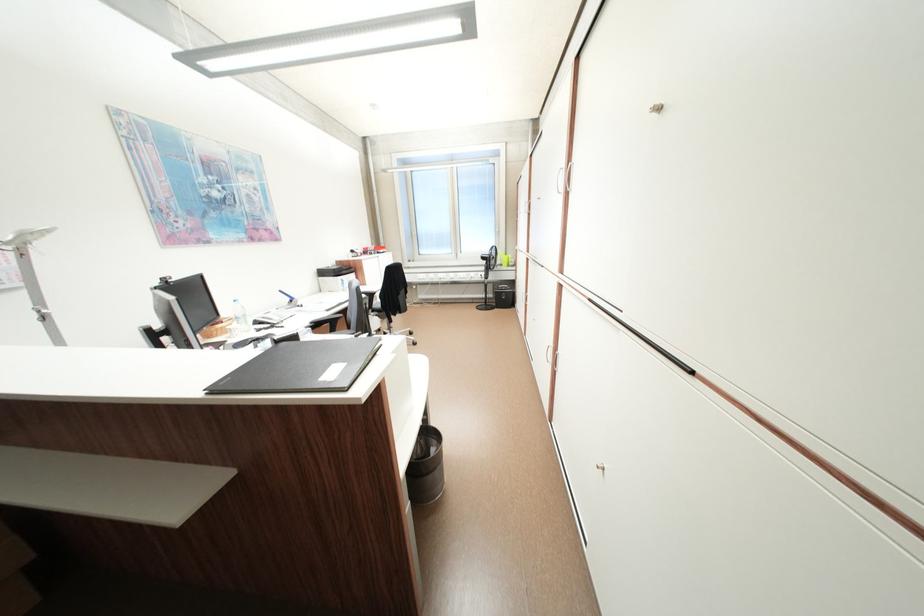
The location [488,276] corresponds to which object?

It corresponds to the black fan in the image.